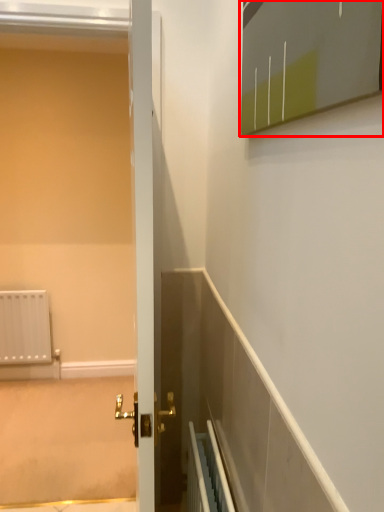
Question: From the image's perspective, considering the relative positions of medicine cabinet (annotated by the red box) and screen door in the image provided, where is medicine cabinet (annotated by the red box) located with respect to the staircase?

Choices:
 (A) below
 (B) above

Answer: (B)